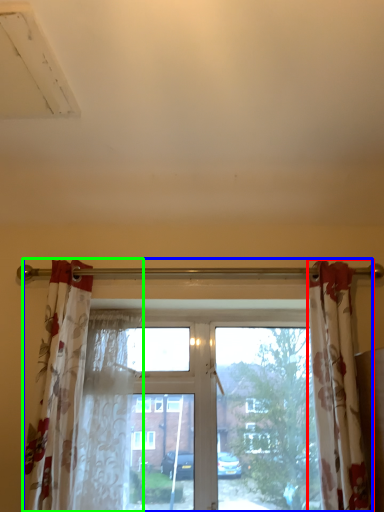
Question: Which is nearer to the curtain (highlighted by a red box)? window (highlighted by a blue box) or curtain (highlighted by a green box).

Choices:
 (A) window
 (B) curtain

Answer: (A)